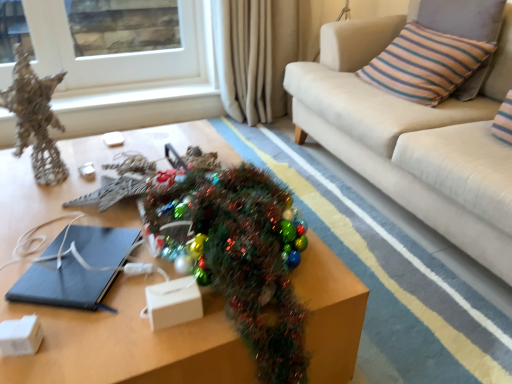
Identify the location of vacant area situated to the left side of metallic wire sculpture at left. (14, 170).